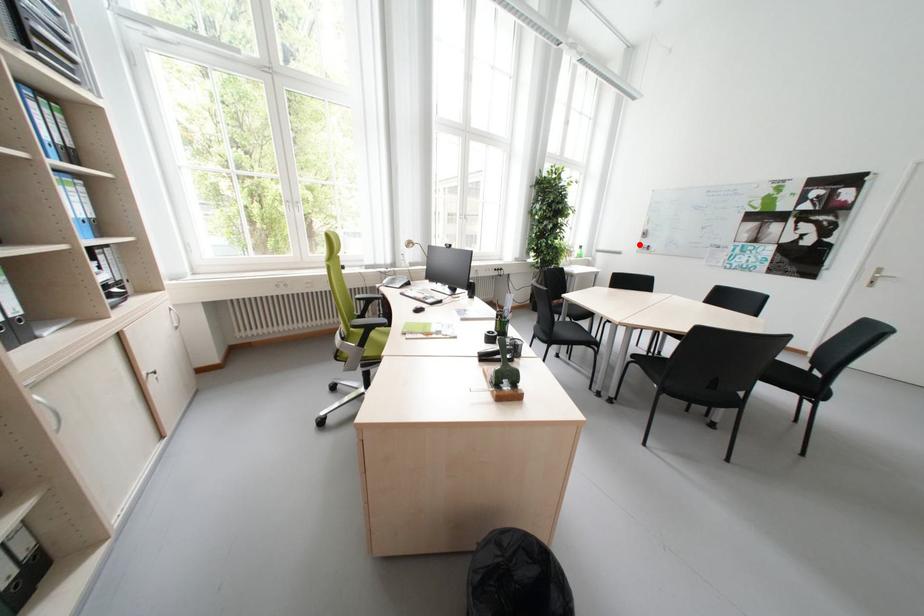
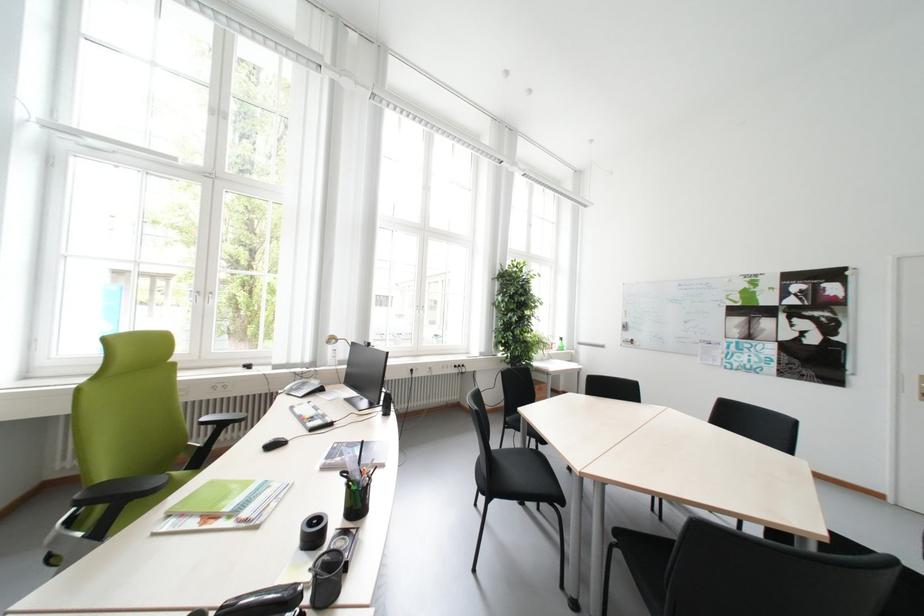
Question: I am providing you with two images of the same scene from different viewpoints. In image1, a red point is highlighted. Considering the same 3D point in image2, which of the following is correct?

Choices:
 (A) It is closer
 (B) It is farther

Answer: (B)